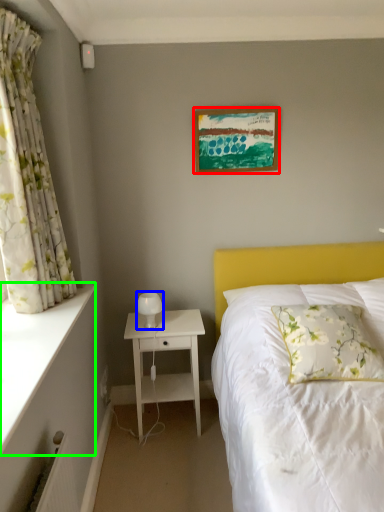
Question: Based on their relative distances, which object is farther from picture frame (highlighted by a red box)? Choose from table lamp (highlighted by a blue box) and ledge (highlighted by a green box).

Choices:
 (A) table lamp
 (B) ledge

Answer: (B)